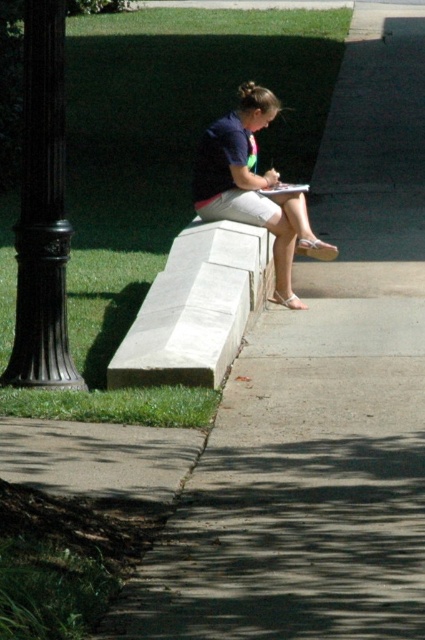
Does white stone bench at center have a lesser height compared to matte blue shirt at center?

Correct, white stone bench at center is not as tall as matte blue shirt at center.

Does white stone bench at center have a lesser width compared to matte blue shirt at center?

Indeed, white stone bench at center has a lesser width compared to matte blue shirt at center.

What do you see at coordinates (195, 307) in the screenshot?
I see `white stone bench at center` at bounding box center [195, 307].

The width and height of the screenshot is (425, 640). What are the coordinates of `white stone bench at center` in the screenshot? It's located at (195, 307).

Looking at this image, is black polished metal pole at left taller than matte blue shirt at center?

Yes.

Is black polished metal pole at left above matte blue shirt at center?

Actually, black polished metal pole at left is below matte blue shirt at center.

Is point (28, 12) more distant than point (275, 218)?

No.

This screenshot has width=425, height=640. I want to click on black polished metal pole at left, so click(42, 211).

Is black polished metal pole at left in front of white stone bench at center?

Yes, black polished metal pole at left is in front of white stone bench at center.

Can you confirm if black polished metal pole at left is wider than white stone bench at center?

No, black polished metal pole at left is not wider than white stone bench at center.

Is point (47, 112) closer to viewer compared to point (187, 284)?

Yes.

I want to click on black polished metal pole at left, so click(x=42, y=211).